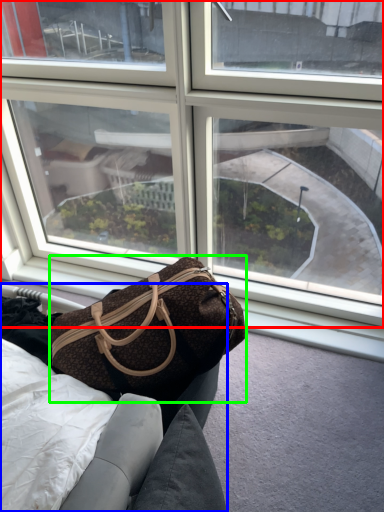
Question: Which is nearer to the window (highlighted by a red box)? furniture (highlighted by a blue box) or handbag (highlighted by a green box).

Choices:
 (A) furniture
 (B) handbag

Answer: (B)